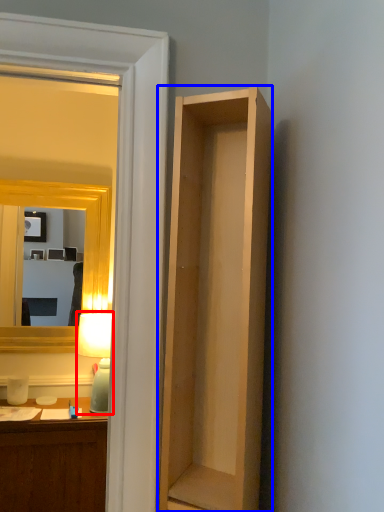
Question: Which of the following is the farthest to the observer, lamp (highlighted by a red box) or cabinetry (highlighted by a blue box)?

Choices:
 (A) lamp
 (B) cabinetry

Answer: (A)